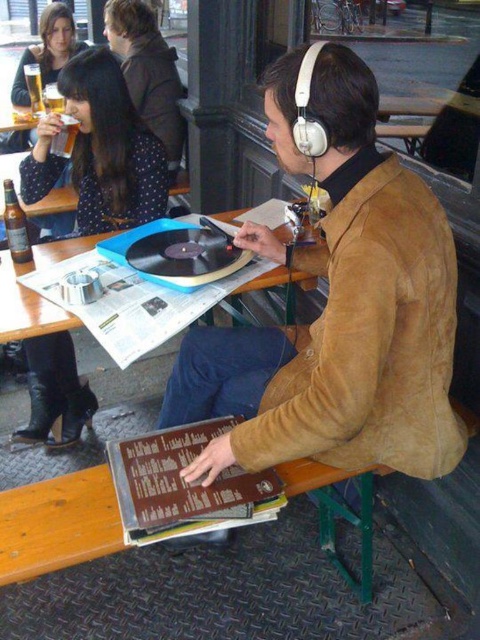
Is brown suede jacket at upper center taller than blue plastic record player at center?

Indeed, brown suede jacket at upper center has a greater height compared to blue plastic record player at center.

Is brown suede jacket at upper center bigger than blue plastic record player at center?

Indeed, brown suede jacket at upper center has a larger size compared to blue plastic record player at center.

Is point (146, 92) positioned in front of point (35, 252)?

No.

The image size is (480, 640). Identify the location of brown suede jacket at upper center. point(147,72).

Does brown suede jacket at upper center appear under translucent glass beer at upper left?

Indeed, brown suede jacket at upper center is positioned under translucent glass beer at upper left.

Between point (141, 113) and point (36, 99), which one is positioned behind?

Positioned behind is point (36, 99).

Is point (136, 74) more distant than point (33, 93)?

No, it is in front of (33, 93).

Find the location of a particular element. Image resolution: width=480 pixels, height=640 pixels. brown suede jacket at upper center is located at coordinates (147, 72).

Who is shorter, matte black dress at upper left or brown glass bottle at left?

With less height is brown glass bottle at left.

Is point (113, 154) positioned after point (6, 195)?

Yes, point (113, 154) is farther from viewer.

Image resolution: width=480 pixels, height=640 pixels. I want to click on matte black dress at upper left, so click(x=110, y=147).